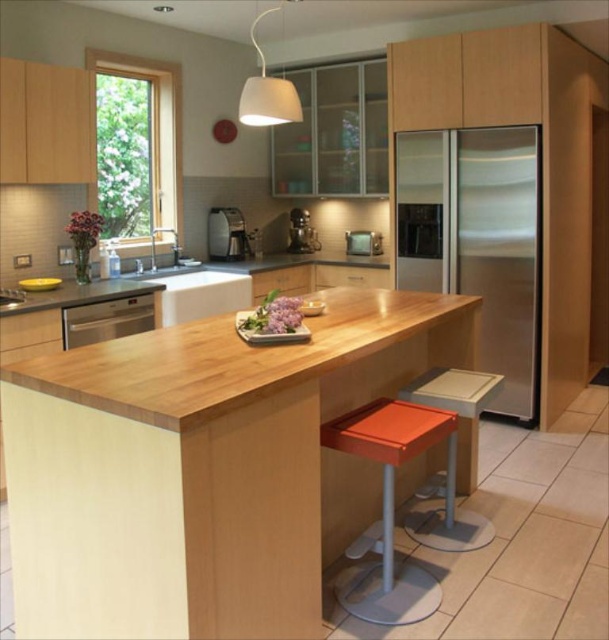
You are a person who is 1.8 meters tall and wants to use the satin silver microwave at center. You are currently standing near the orange plastic stool at lower center. Can you comfortably reach the microwave without bending down?

The orange plastic stool at lower center is much taller than the satin silver microwave at center. Since the microwave is shorter than the stool, you can comfortably reach it without bending down.

You are moving a 1.2 meter wide sofa through the kitchen and need to navigate between the stainless steel refrigerator at right and the satin silver microwave at center. Can the sofa fit through the space between them?

The distance between the stainless steel refrigerator at right and the satin silver microwave at center is 1.13 meters. Since the sofa is 1.2 meters wide, it cannot fit through the space between them as the gap is narrower than the sofa.

You are planning to place a new appliance in your kitchen. You have a small microwave that is 30 cm wide. The wooden at center and the stainless steel refrigerator at right are in the way. Which object can you move to make space for the microwave?

The stainless steel refrigerator at right is smaller in size than the wooden at center, so it might be easier to move the stainless steel refrigerator at right to make space for the microwave.